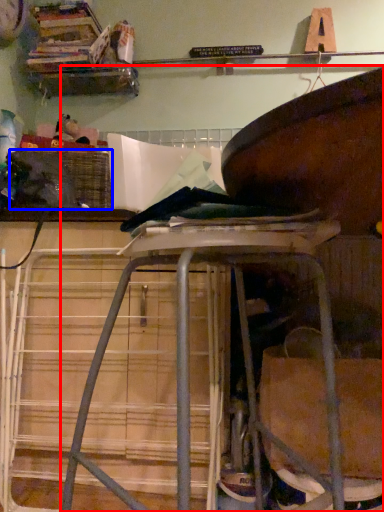
Question: Which point is further to the camera, furniture (highlighted by a red box) or crate (highlighted by a blue box)?

Choices:
 (A) furniture
 (B) crate

Answer: (B)